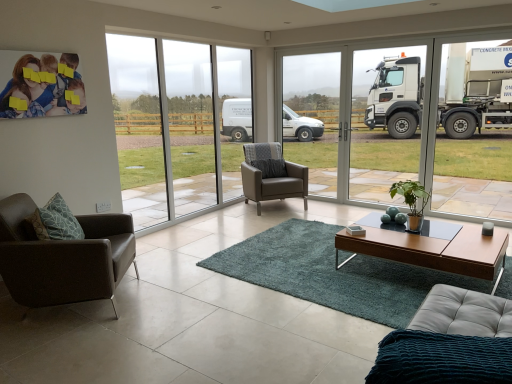
Where is `empty space that is in between green matte plant at center and translucent glass table at center`? Image resolution: width=512 pixels, height=384 pixels. empty space that is in between green matte plant at center and translucent glass table at center is located at coordinates (393, 235).